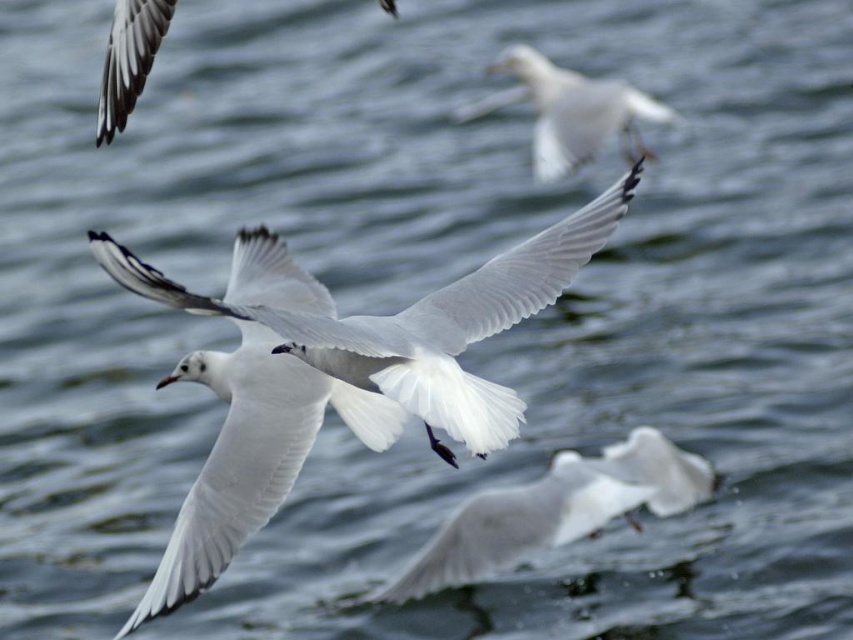
You are a birdwatcher observing the scene. You notice the white feathered bird at center and the white matte wing at upper left. Which object is closer to the bottom of the image?

The white feathered bird at center is closer to the bottom of the image because it has a lesser height compared to the white matte wing at upper left.

From the picture: You are a birdwatcher observing the scene. You notice two birds in the image. Which one is positioned closer to you, the white feathered bird at center or the white matte bird at upper center?

The white feathered bird at center is closer to the viewer than the white matte bird at upper center.